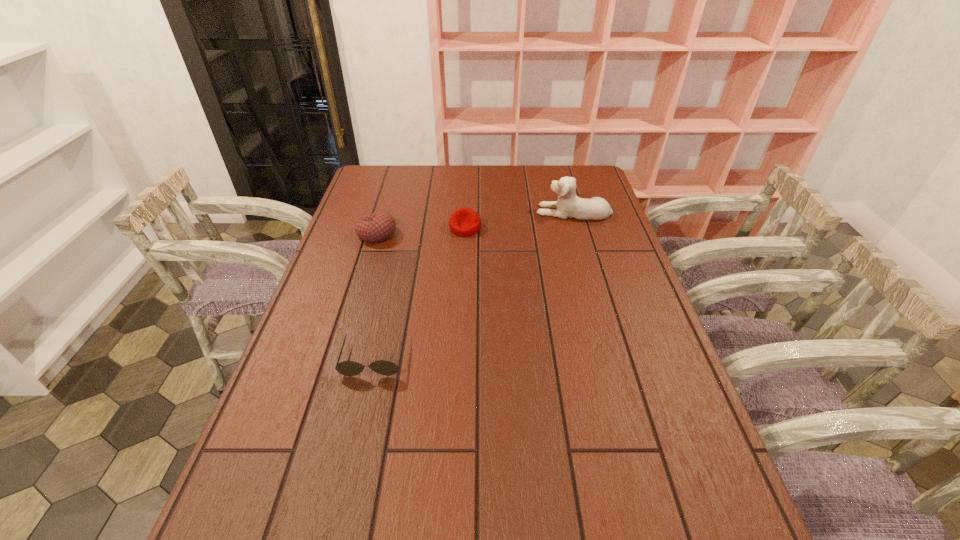
Locate an element on the screen. empty location between the sunglasses and the taller beanbag is located at coordinates (375, 296).

Locate which object is the third closest to the sunglasses. Please provide its 2D coordinates. Your answer should be formatted as a tuple, i.e. [(x, y)], where the tuple contains the x and y coordinates of a point satisfying the conditions above.

[(568, 205)]

Locate an element on the screen. Image resolution: width=960 pixels, height=540 pixels. the second closest object to the rightmost object is located at coordinates (379, 226).

Identify the location of vacant space that satisfies the following two spatial constraints: 1. on the front-facing side of the tallest object; 2. on the front-facing side of the nearest object. The image size is (960, 540). (616, 358).

Locate an element on the screen. This screenshot has width=960, height=540. free space that satisfies the following two spatial constraints: 1. on the front-facing side of the puppy; 2. on the front-facing side of the nearest object is located at coordinates (616, 358).

Identify the location of free point that satisfies the following two spatial constraints: 1. on the front-facing side of the puppy; 2. on the front-facing side of the sunglasses. The image size is (960, 540). (616, 358).